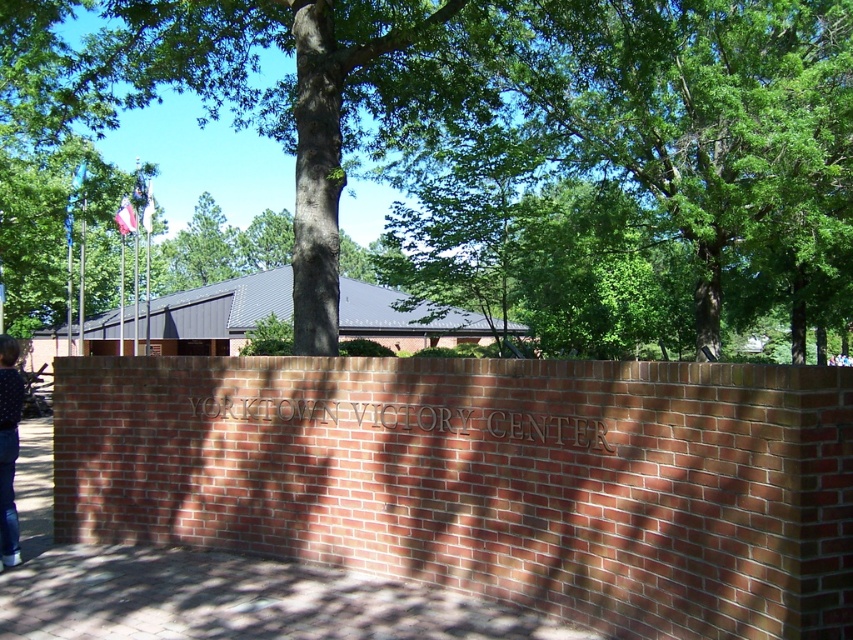
Which is below, green leafy tree at center or blue denim jeans at lower left?

blue denim jeans at lower left is below.

Which is in front, point (631, 134) or point (6, 442)?

Positioned in front is point (6, 442).

Identify the location of green leafy tree at center. (482, 150).